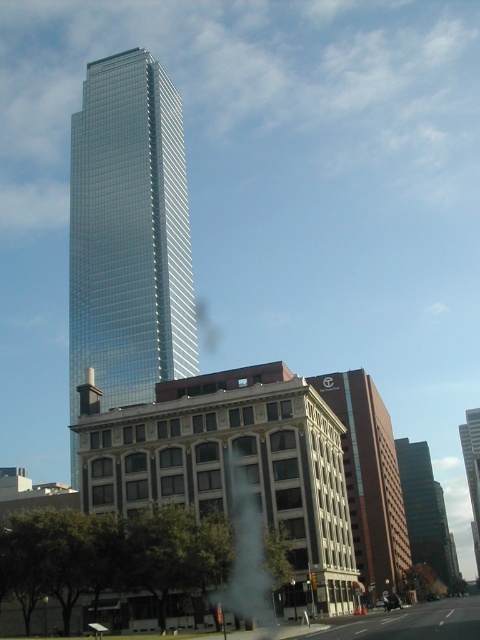
Is point (364, 472) behind point (433, 550)?

No, it is in front of (433, 550).

Does brown brick building at center appear on the right side of dark glass skyscraper at center?

Incorrect, brown brick building at center is not on the right side of dark glass skyscraper at center.

Is point (383, 506) more distant than point (445, 572)?

No, (383, 506) is in front of (445, 572).

The image size is (480, 640). In order to click on brown brick building at center in this screenshot , I will do `click(370, 477)`.

Which of these two, shiny glass skyscraper at center or dark glass skyscraper at center, stands shorter?

Standing shorter between the two is dark glass skyscraper at center.

Is shiny glass skyscraper at center thinner than dark glass skyscraper at center?

In fact, shiny glass skyscraper at center might be wider than dark glass skyscraper at center.

Find the location of `shiny glass skyscraper at center`. shiny glass skyscraper at center is located at coordinates (129, 234).

You are a GUI agent. You are given a task and a screenshot of the screen. Output one action in this format:
    pyautogui.click(x=<x>, y=<y>)
    Task: Click on the shiny glass skyscraper at center
    Image resolution: width=480 pixels, height=640 pixels.
    Given the screenshot: What is the action you would take?
    pyautogui.click(x=129, y=234)

Can you confirm if brown brick building at center is smaller than glassy reflective skyscraper at center?

Yes.

Is point (360, 545) more distant than point (477, 560)?

No, (360, 545) is in front of (477, 560).

Which is behind, point (370, 429) or point (478, 490)?

Point (478, 490)

Locate an element on the screen. The image size is (480, 640). brown brick building at center is located at coordinates click(x=370, y=477).